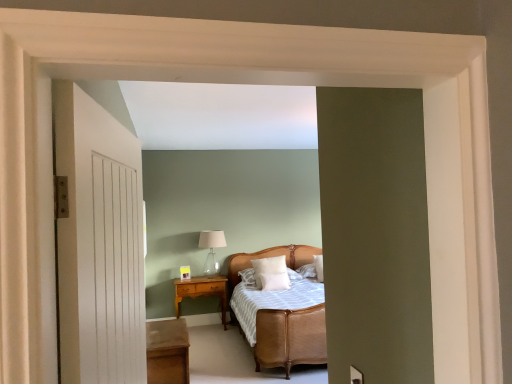
Question: Based on their positions, is white wooden door at left located to the left or right of wooden table at lower left?

Choices:
 (A) left
 (B) right

Answer: (B)

Question: From the image's perspective, relative to wooden table at lower left, is white wooden door at left above or below?

Choices:
 (A) above
 (B) below

Answer: (A)

Question: Considering the real-world distances, which object is farthest from the rattan bed at center?

Choices:
 (A) wooden nightstand at center
 (B) wooden table at lower left
 (C) white soft pillow at center, acting as the 2th pillow starting from the right
 (D) clear glass table lamp at center
 (E) white soft pillow at upper right, arranged as the first pillow when viewed from the right

Answer: (D)

Question: Based on their relative distances, which object is nearer to the white soft pillow at upper right, arranged as the first pillow when viewed from the right?

Choices:
 (A) white wooden door at left
 (B) white soft pillow at center, acting as the 2th pillow starting from the right
 (C) rattan bed at center
 (D) wooden nightstand at center
 (E) clear glass table lamp at center

Answer: (B)